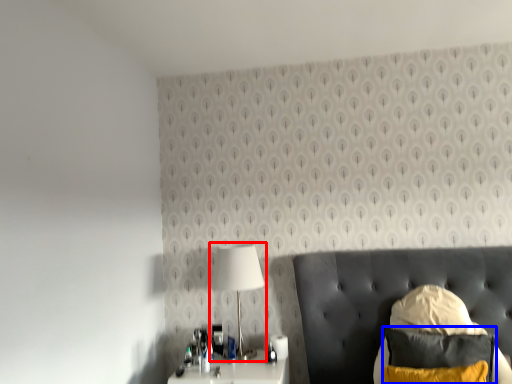
Question: Which point is closer to the camera, lamp (highlighted by a red box) or pillow (highlighted by a blue box)?

Choices:
 (A) lamp
 (B) pillow

Answer: (B)